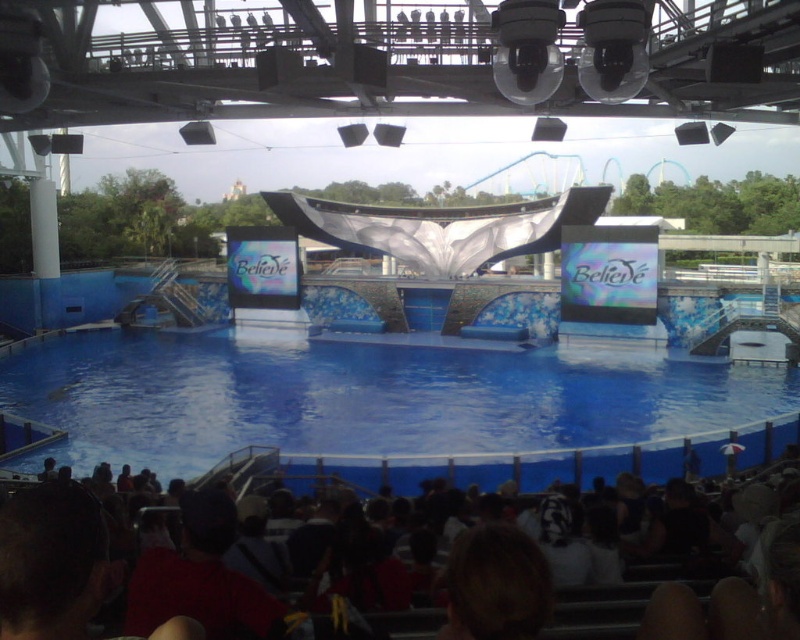
Can you confirm if blue glossy water at center is thinner than dark brown hair at lower center?

No, blue glossy water at center is not thinner than dark brown hair at lower center.

Measure the distance from blue glossy water at center to dark brown hair at lower center.

109.36 feet

Measure the distance between point (254, 436) and camera.

85.10 meters

I want to click on blue glossy water at center, so click(x=380, y=403).